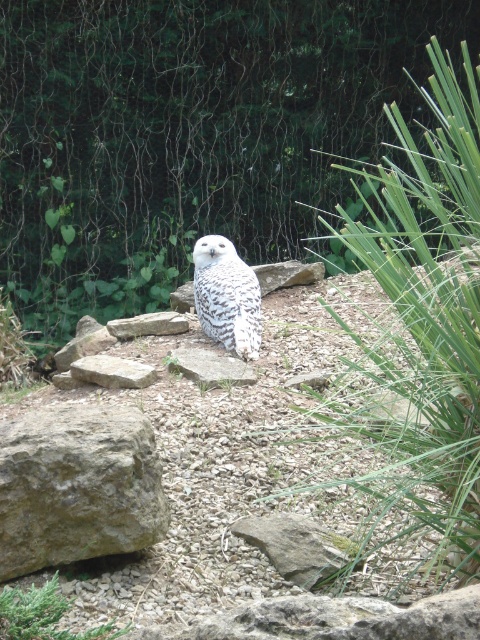
Can you confirm if white speckled owl at center is thinner than gray rough stone at center?

Yes.

Which of these two, white speckled owl at center or gray rough stone at center, stands taller?

white speckled owl at center is taller.

Does point (219, 284) lie behind point (79, 365)?

Yes, point (219, 284) is behind point (79, 365).

Locate an element on the screen. The height and width of the screenshot is (640, 480). white speckled owl at center is located at coordinates (227, 296).

Between brown rough rock at lower left and gray rough rock at center, which one appears on the right side from the viewer's perspective?

gray rough rock at center is more to the right.

Does brown rough rock at lower left have a lesser width compared to gray rough rock at center?

No, brown rough rock at lower left is not thinner than gray rough rock at center.

Measure the distance between point (132, 524) and camera.

They are 3.30 meters apart.

Where is `brown rough rock at lower left`? The width and height of the screenshot is (480, 640). brown rough rock at lower left is located at coordinates (76, 486).

Can you confirm if gray rough stone at center is positioned to the left of gray rock at center?

Yes, gray rough stone at center is to the left of gray rock at center.

Identify the location of gray rough stone at center. The height and width of the screenshot is (640, 480). (111, 371).